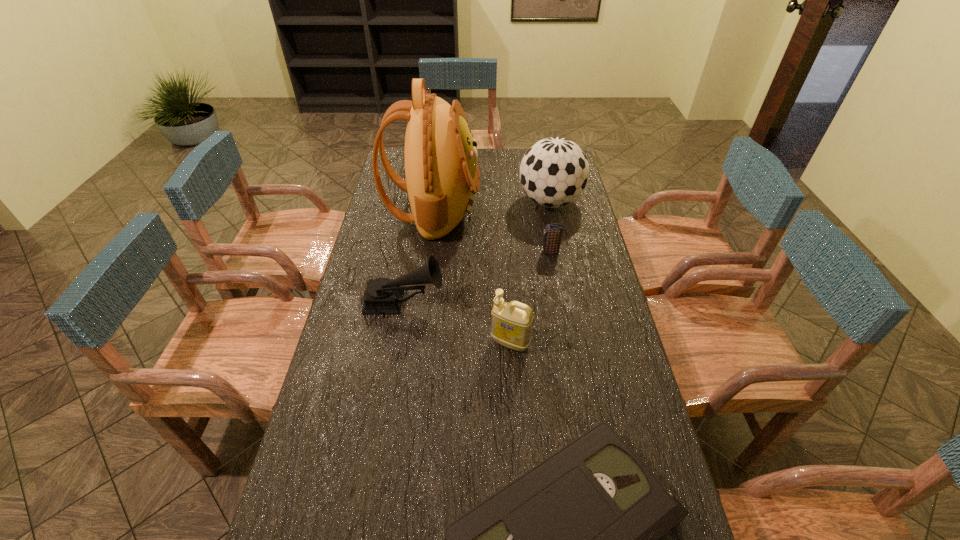
The image size is (960, 540). Identify the location of vacant space positioned with the zip open on the fifth tallest object. (514, 252).

Identify the location of vacant space located with the zip open on the fifth tallest object. (435, 252).

Locate an element on the screen. This screenshot has height=540, width=960. blank space located 0.240m with the zip open on the fifth tallest object is located at coordinates (476, 252).

The height and width of the screenshot is (540, 960). Identify the location of backpack that is at the left edge. (442, 176).

Find the location of `phonograph_record that is positioned at the left edge`. phonograph_record that is positioned at the left edge is located at coordinates (383, 296).

You are a GUI agent. You are given a task and a screenshot of the screen. Output one action in this format:
    pyautogui.click(x=<x>, y=<y>)
    Task: Click on the soccer ball located at the right edge
    The width and height of the screenshot is (960, 540).
    Given the screenshot: What is the action you would take?
    pyautogui.click(x=554, y=172)

Image resolution: width=960 pixels, height=540 pixels. Find the location of `clutch bag present at the right edge`. clutch bag present at the right edge is located at coordinates (553, 232).

Locate an element on the screen. free space at the far edge is located at coordinates pos(481,167).

You are a GUI agent. You are given a task and a screenshot of the screen. Output one action in this format:
    pyautogui.click(x=<x>, y=<y>)
    Task: Click on the vacant space at the left edge
    This screenshot has width=960, height=540.
    Given the screenshot: What is the action you would take?
    pyautogui.click(x=355, y=406)

This screenshot has height=540, width=960. What are the coordinates of `vacant space at the right edge of the desktop` in the screenshot? It's located at (578, 371).